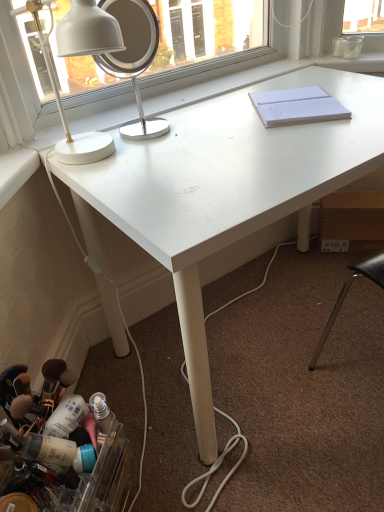
Question: Considering the relative positions of white smooth window sill at upper right and white paper notebook at upper right in the image provided, is white smooth window sill at upper right to the left of white paper notebook at upper right from the viewer's perspective?

Choices:
 (A) yes
 (B) no

Answer: (B)

Question: Does white smooth window sill at upper right have a lesser width compared to white paper notebook at upper right?

Choices:
 (A) yes
 (B) no

Answer: (A)

Question: Could you tell me if white smooth window sill at upper right is turned towards white paper notebook at upper right?

Choices:
 (A) yes
 (B) no

Answer: (A)

Question: Is there a large distance between white smooth window sill at upper right and white paper notebook at upper right?

Choices:
 (A) no
 (B) yes

Answer: (A)

Question: From the image's perspective, is white smooth window sill at upper right below white paper notebook at upper right?

Choices:
 (A) no
 (B) yes

Answer: (A)

Question: In the image, is white metallic mirror at upper left on the left side or the right side of white matte desk at center?

Choices:
 (A) left
 (B) right

Answer: (A)

Question: From the image's perspective, is white metallic mirror at upper left located above or below white matte desk at center?

Choices:
 (A) above
 (B) below

Answer: (A)

Question: Is white metallic mirror at upper left inside or outside of white matte desk at center?

Choices:
 (A) outside
 (B) inside

Answer: (A)

Question: Is white metallic mirror at upper left bigger or smaller than white matte desk at center?

Choices:
 (A) big
 (B) small

Answer: (B)

Question: From a real-world perspective, is white paper notebook at upper right physically located above or below white smooth window sill at upper right?

Choices:
 (A) below
 (B) above

Answer: (B)

Question: Based on their positions, is white paper notebook at upper right located to the left or right of white smooth window sill at upper right?

Choices:
 (A) left
 (B) right

Answer: (A)

Question: From the image's perspective, is white paper notebook at upper right above or below white smooth window sill at upper right?

Choices:
 (A) above
 (B) below

Answer: (B)

Question: From their relative heights in the image, would you say white paper notebook at upper right is taller or shorter than white smooth window sill at upper right?

Choices:
 (A) short
 (B) tall

Answer: (B)

Question: From a real-world perspective, is white glossy desk lamp at upper left physically located above or below white matte desk at center?

Choices:
 (A) below
 (B) above

Answer: (B)

Question: Is white glossy desk lamp at upper left wider or thinner than white matte desk at center?

Choices:
 (A) thin
 (B) wide

Answer: (A)